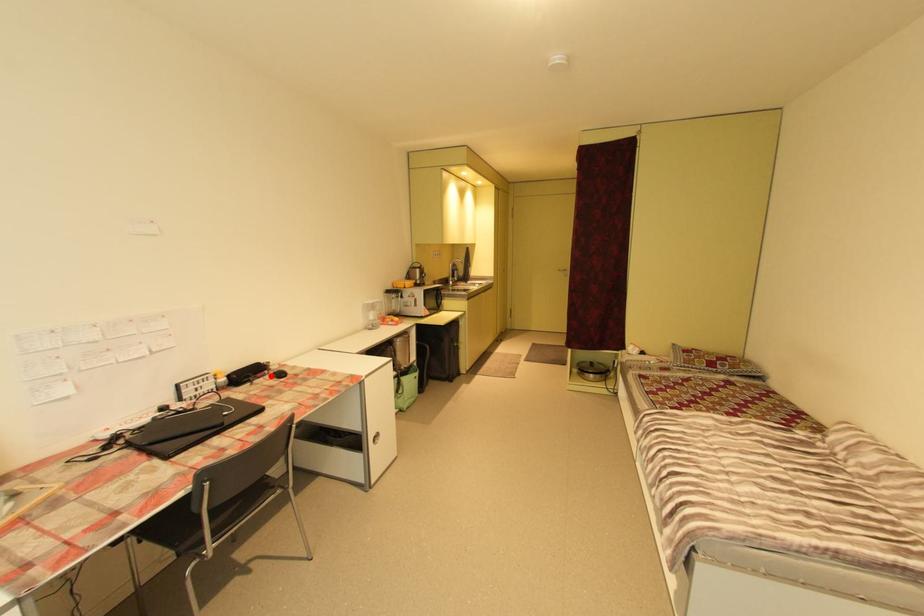
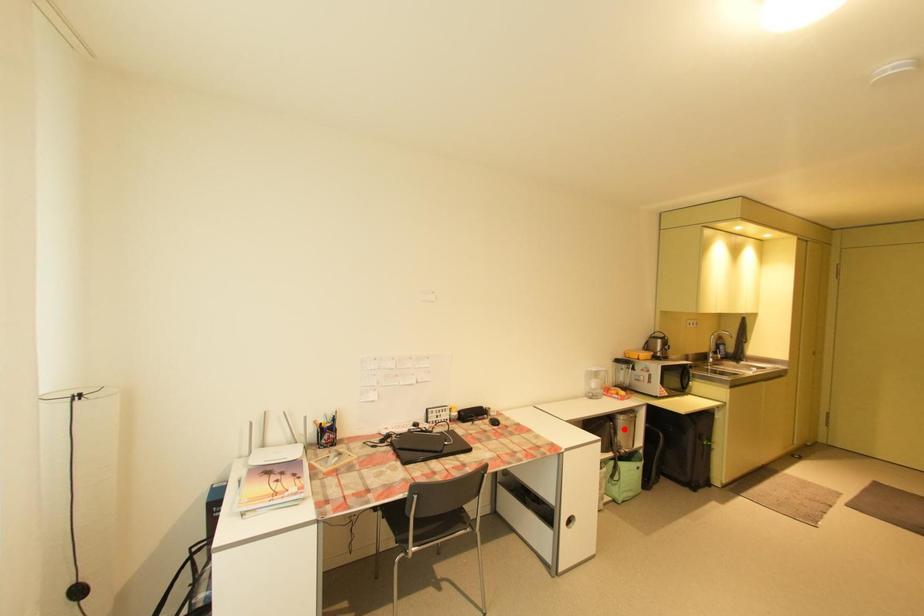
I am providing you with two images of the same scene from different viewpoints. A red point is marked on the first image and another point is marked on the second image. Is the marked point in image1 the same physical position as the marked point in image2?

No